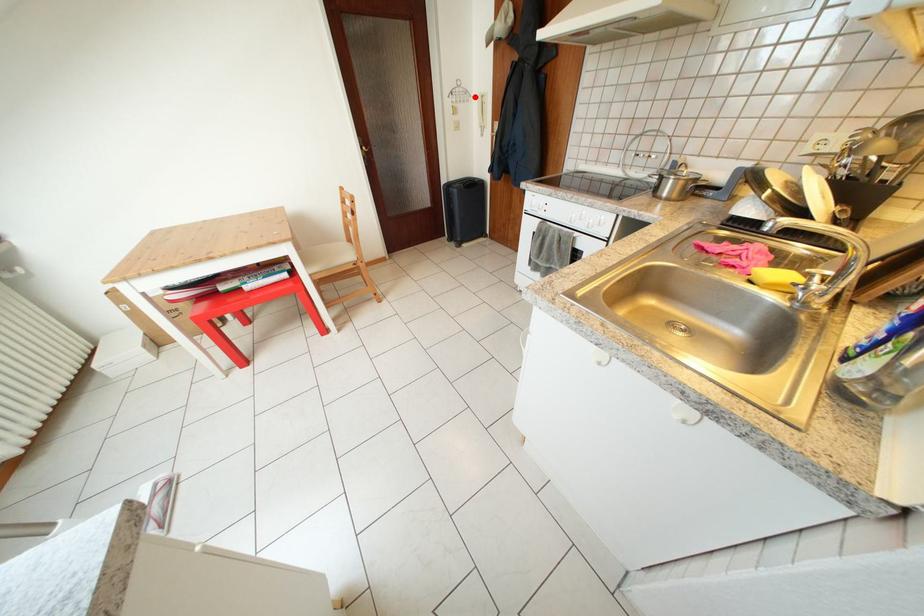
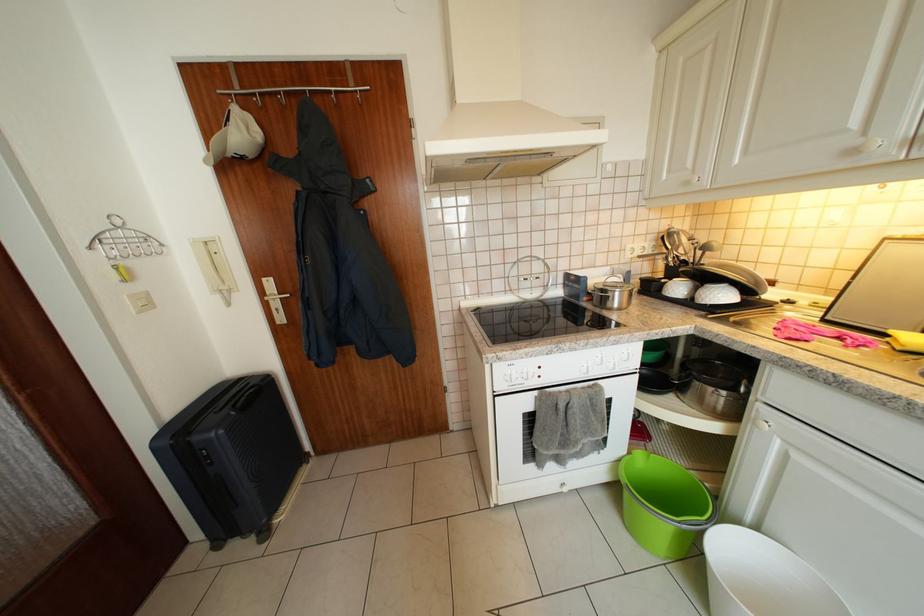
Question: A red point is marked in image1. In image2, is the corresponding 3D point closer to the camera or farther? Reply with the corresponding letter.

Choices:
 (A) The corresponding 3D point is closer.
 (B) The corresponding 3D point is farther.

Answer: (B)